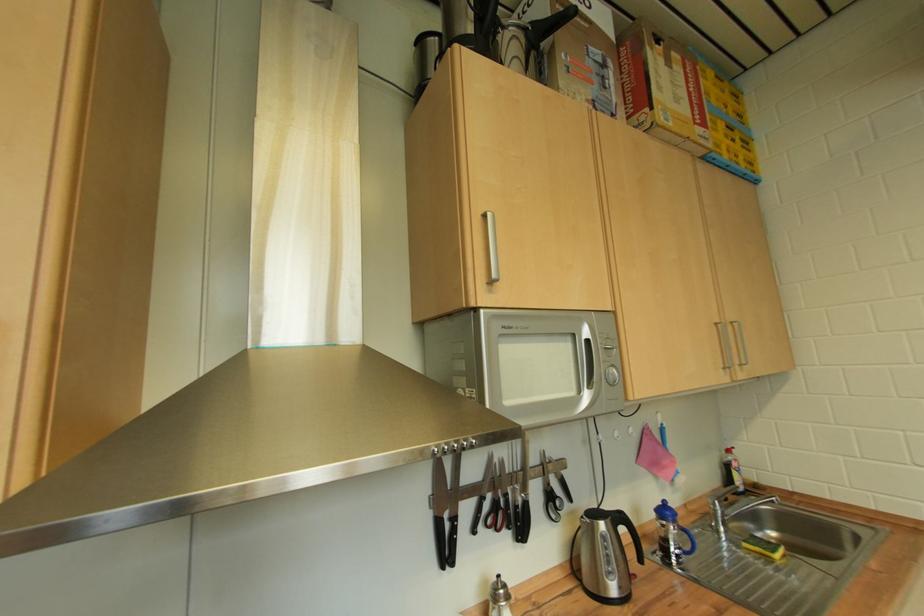
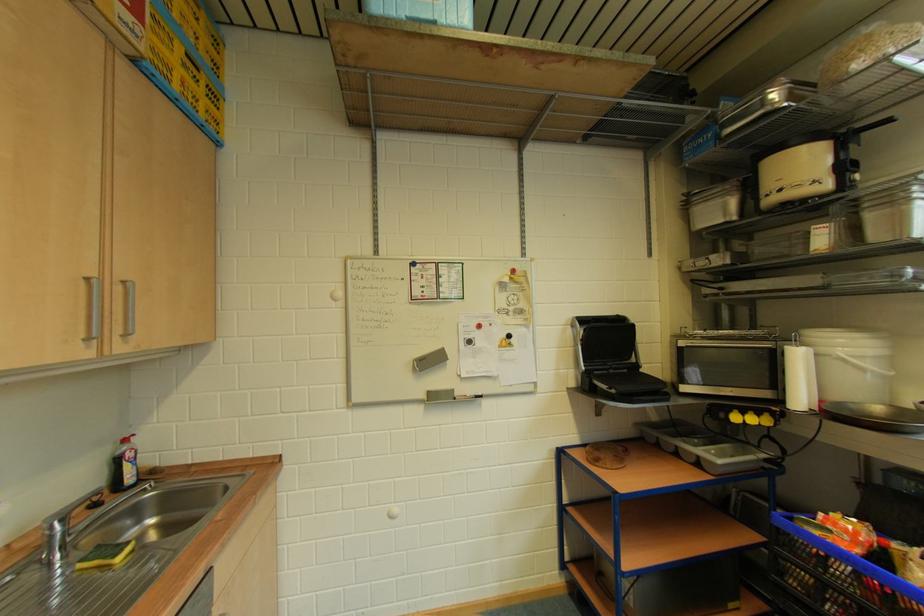
In the second image, find the point that corresponds to point 738,325 in the first image.

(130, 285)